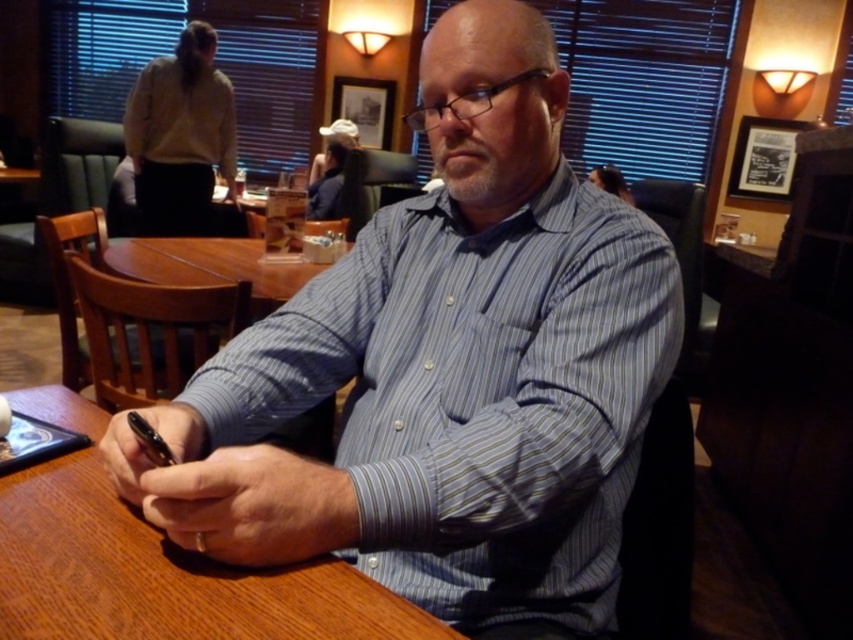
Is point (165, 509) positioned in front of point (360, 595)?

No, it is behind (360, 595).

Can you confirm if blue striped shirt at center is taller than wooden table at center?

Yes.

Which is in front, point (608, 420) or point (155, 561)?

Point (155, 561) is in front.

Identify the location of blue striped shirt at center. This screenshot has height=640, width=853. (445, 371).